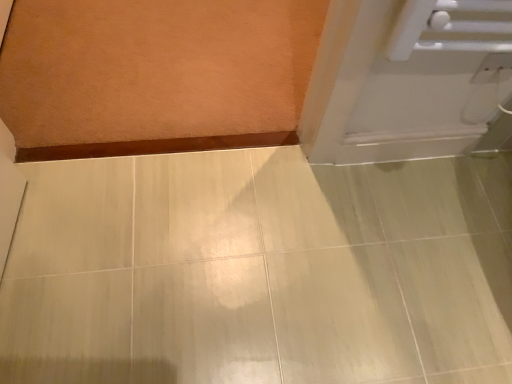
Describe the element at coordinates (260, 271) in the screenshot. The image size is (512, 384). I see `white glossy tile at center` at that location.

Locate an element on the screen. white glossy tile at center is located at coordinates (260, 271).

What are the coordinates of `white glossy tile at center` in the screenshot? It's located at (260, 271).